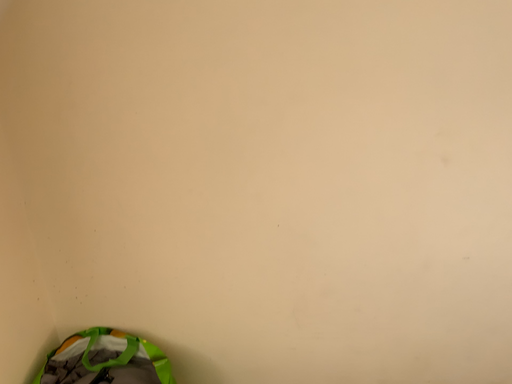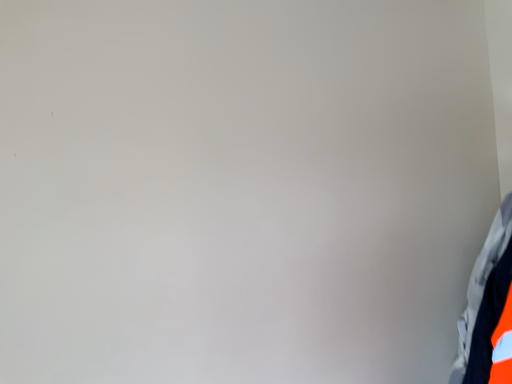
Question: How did the camera likely rotate when shooting the video?

Choices:
 (A) rotated downward
 (B) rotated upward

Answer: (B)